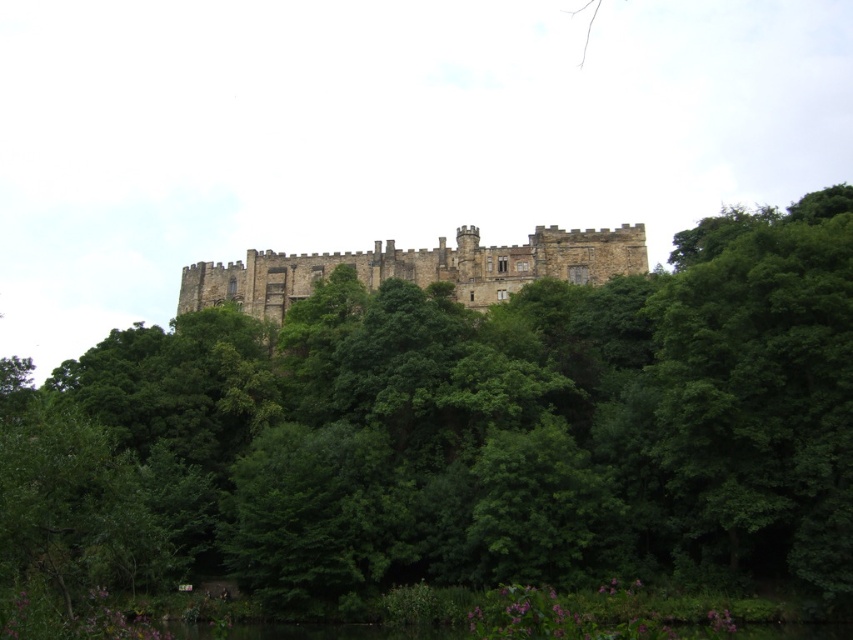
Where is `green leafy tree at center`? This screenshot has height=640, width=853. green leafy tree at center is located at coordinates (456, 438).

The image size is (853, 640). What are the coordinates of `green leafy tree at center` in the screenshot? It's located at (456, 438).

This screenshot has width=853, height=640. I want to click on green leafy tree at center, so point(456,438).